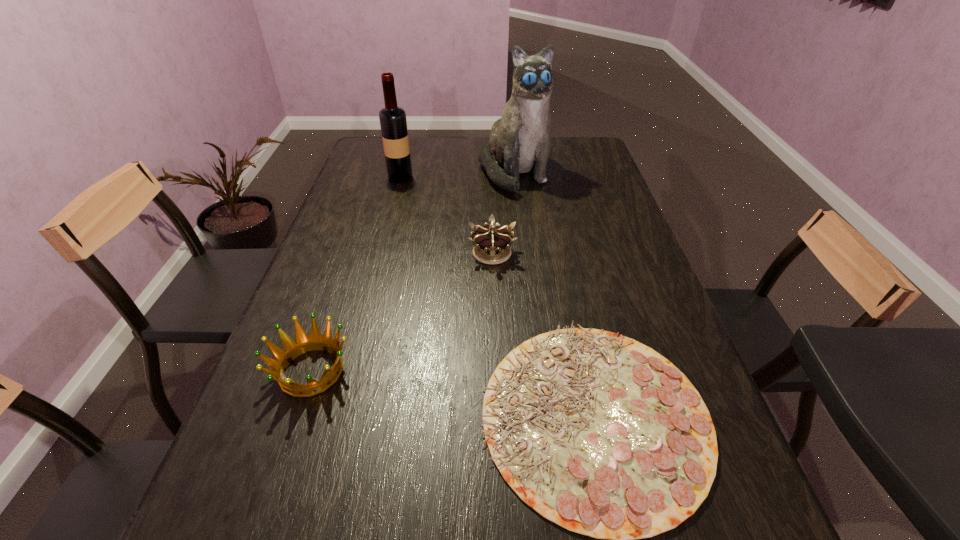
The height and width of the screenshot is (540, 960). I want to click on wine bottle situated at the left edge, so click(x=393, y=123).

The image size is (960, 540). Identify the location of crown that is at the left edge. coord(303,344).

Locate an element on the screen. The height and width of the screenshot is (540, 960). blank space at the far edge of the desktop is located at coordinates (417, 153).

This screenshot has width=960, height=540. In the image, there is a desktop. Find the location of `blank space at the left edge`. blank space at the left edge is located at coordinates (305, 481).

Locate an element on the screen. The height and width of the screenshot is (540, 960). vacant space at the right edge is located at coordinates (709, 529).

Where is `free space at the far left corner`? The height and width of the screenshot is (540, 960). free space at the far left corner is located at coordinates (372, 151).

In the image, there is a desktop. Find the location of `vacant space at the far right corner`. vacant space at the far right corner is located at coordinates (571, 159).

The height and width of the screenshot is (540, 960). I want to click on free space between the left crown and the farther crown, so click(x=401, y=312).

At what (x,y) coordinates should I click in order to perform the action: click on vacant space that is in between the cat and the left crown. Please return your answer as a coordinate pair (x, y). Looking at the image, I should click on (413, 272).

Where is `free spot between the farther crown and the wine bottle`? This screenshot has width=960, height=540. free spot between the farther crown and the wine bottle is located at coordinates (446, 215).